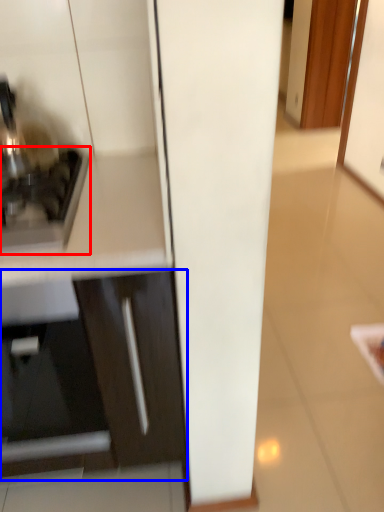
Question: Which object appears closest to the camera in this image, home appliance (highlighted by a red box) or cabinetry (highlighted by a blue box)?

Choices:
 (A) home appliance
 (B) cabinetry

Answer: (B)